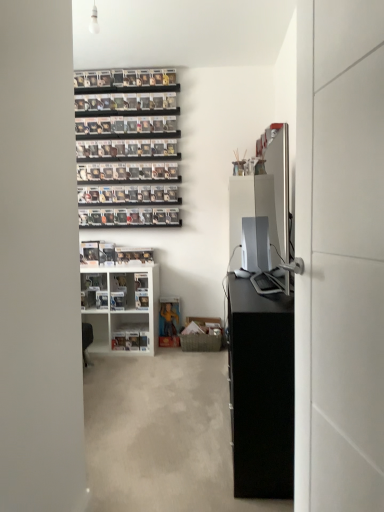
Question: Is white plastic shelf at lower center, the 2th shelf when ordered from top to bottom, positioned far away from black matte cabinet at right?

Choices:
 (A) yes
 (B) no

Answer: (A)

Question: Does white plastic shelf at lower center, the 2th shelf when ordered from top to bottom, have a smaller size compared to black matte cabinet at right?

Choices:
 (A) no
 (B) yes

Answer: (B)

Question: Is white plastic shelf at lower center, which appears as the first shelf when ordered from the bottom, thinner than black matte cabinet at right?

Choices:
 (A) no
 (B) yes

Answer: (B)

Question: From the image's perspective, does white plastic shelf at lower center, which appears as the first shelf when ordered from the bottom, appear higher than black matte cabinet at right?

Choices:
 (A) yes
 (B) no

Answer: (B)

Question: Is white plastic shelf at lower center, the 2th shelf when ordered from top to bottom, shorter than black matte cabinet at right?

Choices:
 (A) yes
 (B) no

Answer: (A)

Question: In terms of width, does white plastic shelf at lower center, the 2th shelf when ordered from top to bottom, look wider or thinner when compared to satin silver desktop at center?

Choices:
 (A) thin
 (B) wide

Answer: (A)

Question: From the image's perspective, relative to satin silver desktop at center, is white plastic shelf at lower center, the 2th shelf when ordered from top to bottom, above or below?

Choices:
 (A) above
 (B) below

Answer: (B)

Question: From a real-world perspective, is white plastic shelf at lower center, the 2th shelf when ordered from top to bottom, positioned above or below satin silver desktop at center?

Choices:
 (A) above
 (B) below

Answer: (B)

Question: Is white plastic shelf at lower center, the 2th shelf when ordered from top to bottom, in front of or behind satin silver desktop at center in the image?

Choices:
 (A) front
 (B) behind

Answer: (B)

Question: Based on their sizes in the image, would you say black matte cabinet at right is bigger or smaller than white plastic shelf at lower center, which appears as the first shelf when ordered from the bottom?

Choices:
 (A) small
 (B) big

Answer: (B)

Question: Based on their positions, is black matte cabinet at right located to the left or right of white plastic shelf at lower center, the 2th shelf when ordered from top to bottom?

Choices:
 (A) right
 (B) left

Answer: (A)

Question: From the image's perspective, is black matte cabinet at right above or below white plastic shelf at lower center, which appears as the first shelf when ordered from the bottom?

Choices:
 (A) below
 (B) above

Answer: (B)

Question: From a real-world perspective, is black matte cabinet at right physically located above or below white plastic shelf at lower center, which appears as the first shelf when ordered from the bottom?

Choices:
 (A) below
 (B) above

Answer: (B)

Question: Would you say white glossy door at right is inside or outside satin silver desktop at center?

Choices:
 (A) outside
 (B) inside

Answer: (A)

Question: In the image, is white glossy door at right positioned in front of or behind satin silver desktop at center?

Choices:
 (A) front
 (B) behind

Answer: (A)